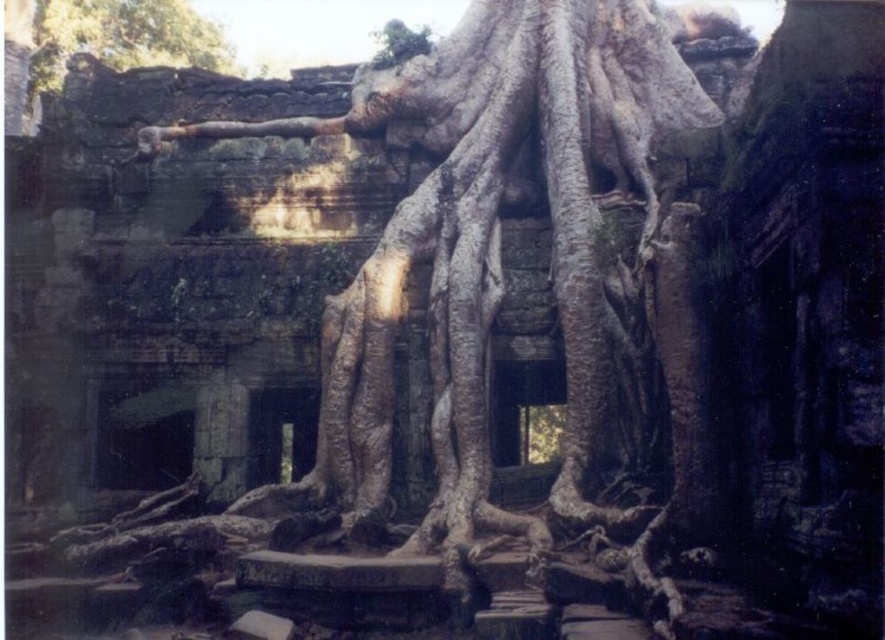
You are an archaeologist examining the ancient stone structure. You notice two sets of roots, the gray textured roots at center and the brown textured roots at upper left. Which of these roots could potentially cause more structural damage to the ruins based on their size?

The gray textured roots at center is larger in size than the brown textured roots at upper left, so it could potentially cause more structural damage to the ruins.

You are an archaeologist examining the ancient stone structure. You notice two sets of roots, the gray textured roots at center and the brown textured roots at upper left. Which set of roots appears closer to you?

The gray textured roots at center appear closer to you because they are positioned in front of the brown textured roots at upper left.

You are an archaeologist examining the ancient stone structure. You notice two sets of roots, the gray textured roots at center and the brown textured roots at upper left. Which of these roots are wider?

The gray textured roots at center are wider than the brown textured roots at upper left.